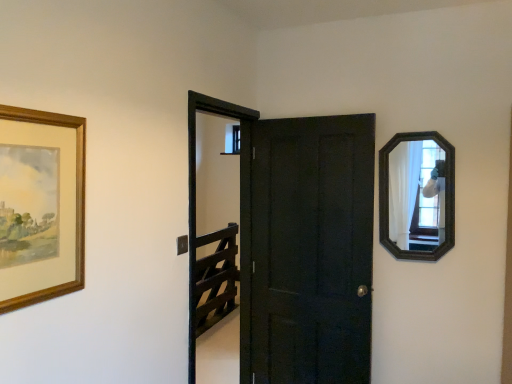
The image size is (512, 384). What do you see at coordinates (76, 202) in the screenshot?
I see `wooden picture frame at left` at bounding box center [76, 202].

In order to face matte black door at center, should I rotate leftwards or rightwards?

Turn right approximately 6.798 degrees to face it.

Where is `wooden-framed mirror at upper right`? This screenshot has height=384, width=512. wooden-framed mirror at upper right is located at coordinates (416, 195).

From a real-world perspective, between wooden picture frame at left and wooden-framed mirror at upper right, who is vertically lower?

wooden-framed mirror at upper right is physically lower.

Looking at their sizes, would you say wooden picture frame at left is wider or thinner than wooden-framed mirror at upper right?

Clearly, wooden picture frame at left has less width compared to wooden-framed mirror at upper right.

Does wooden picture frame at left appear on the right side of wooden-framed mirror at upper right?

No.

Where is `picture frame on the left of matte black door at center`? picture frame on the left of matte black door at center is located at coordinates (76, 202).

Would you say matte black door at center is a long distance from wooden picture frame at left?

matte black door at center is positioned a significant distance from wooden picture frame at left.

Is matte black door at center in front of wooden picture frame at left?

No, it is behind wooden picture frame at left.

Based on the photo, from the image's perspective, is matte black door at center on wooden picture frame at left?

No.

Is matte black door at center turned away from wooden-framed mirror at upper right?

matte black door at center is not turned away from wooden-framed mirror at upper right.

Is matte black door at center not inside wooden-framed mirror at upper right?

Yes.

Are matte black door at center and wooden-framed mirror at upper right located far from each other?

No.

From the image's perspective, would you say matte black door at center is shown under wooden-framed mirror at upper right?

Correct, matte black door at center appears lower than wooden-framed mirror at upper right in the image.

Considering the positions of point (242, 201) and point (429, 148), is point (242, 201) closer or farther from the camera than point (429, 148)?

Point (242, 201) is farther from the camera than point (429, 148).

Which is more to the left, black wooden screen door at center or wooden-framed mirror at upper right?

black wooden screen door at center.

Between black wooden screen door at center and wooden-framed mirror at upper right, which one has less height?

Standing shorter between the two is wooden-framed mirror at upper right.

From a real-world perspective, does black wooden screen door at center sit lower than wooden-framed mirror at upper right?

Correct, in the physical world, black wooden screen door at center is lower than wooden-framed mirror at upper right.

Considering the sizes of objects wooden-framed mirror at upper right and black wooden screen door at center in the image provided, who is taller, wooden-framed mirror at upper right or black wooden screen door at center?

Standing taller between the two is black wooden screen door at center.

Considering the points (417, 182) and (246, 248), which point is behind, point (417, 182) or point (246, 248)?

The point (246, 248) is farther from the camera.

Is wooden-framed mirror at upper right situated inside black wooden screen door at center or outside?

wooden-framed mirror at upper right is located beyond the bounds of black wooden screen door at center.

Consider the image. How far apart are black wooden screen door at center and matte black door at center?

They are 10.60 inches apart.

From the image's perspective, who appears lower, black wooden screen door at center or matte black door at center?

matte black door at center appears lower in the image.

Is point (249, 171) farther from viewer compared to point (296, 287)?

That is True.

From the image's perspective, would you say wooden picture frame at left is shown under black wooden screen door at center?

Incorrect, from the image's perspective, wooden picture frame at left is higher than black wooden screen door at center.

Find the location of `screen door on the right of the wooden picture frame at left`. screen door on the right of the wooden picture frame at left is located at coordinates 195,194.

Is wooden picture frame at left wider than black wooden screen door at center?

Incorrect, the width of wooden picture frame at left does not surpass that of black wooden screen door at center.

Is point (77, 135) less distant than point (224, 107)?

Yes.

The image size is (512, 384). In order to click on mirror located underneath the wooden picture frame at left (from a real-world perspective) in this screenshot , I will do `click(416, 195)`.

You are a GUI agent. You are given a task and a screenshot of the screen. Output one action in this format:
    pyautogui.click(x=<x>, y=<y>)
    Task: Click on the door on the right of wooden picture frame at left
    The height and width of the screenshot is (384, 512).
    Given the screenshot: What is the action you would take?
    pyautogui.click(x=293, y=247)

Based on their spatial positions, is matte black door at center or wooden-framed mirror at upper right closer to wooden picture frame at left?

Among the two, matte black door at center is located nearer to wooden picture frame at left.

Estimate the real-world distances between objects in this image. Which object is further from wooden picture frame at left, black wooden screen door at center or matte black door at center?

matte black door at center is positioned further to the anchor wooden picture frame at left.

Looking at the image, which one is located closer to black wooden screen door at center, wooden picture frame at left or matte black door at center?

The object closer to black wooden screen door at center is matte black door at center.

Looking at the image, which one is located closer to matte black door at center, wooden picture frame at left or black wooden screen door at center?

black wooden screen door at center.

Estimate the real-world distances between objects in this image. Which object is closer to black wooden screen door at center, wooden-framed mirror at upper right or wooden picture frame at left?

wooden picture frame at left.

Considering their positions, is wooden-framed mirror at upper right positioned closer to matte black door at center than black wooden screen door at center?

Based on the image, black wooden screen door at center appears to be nearer to matte black door at center.

Based on their spatial positions, is matte black door at center or wooden picture frame at left further from wooden-framed mirror at upper right?

wooden picture frame at left is further to wooden-framed mirror at upper right.

Based on their spatial positions, is wooden-framed mirror at upper right or matte black door at center further from black wooden screen door at center?

The object further to black wooden screen door at center is wooden-framed mirror at upper right.

Locate an element on the screen. Image resolution: width=512 pixels, height=384 pixels. screen door between wooden picture frame at left and wooden-framed mirror at upper right from left to right is located at coordinates (195, 194).

This screenshot has height=384, width=512. I want to click on door between black wooden screen door at center and wooden-framed mirror at upper right from left to right, so click(293, 247).

This screenshot has height=384, width=512. Find the location of `door between wooden picture frame at left and wooden-framed mirror at upper right in the horizontal direction`. door between wooden picture frame at left and wooden-framed mirror at upper right in the horizontal direction is located at coordinates (293, 247).

I want to click on screen door positioned between wooden picture frame at left and matte black door at center from near to far, so click(195, 194).